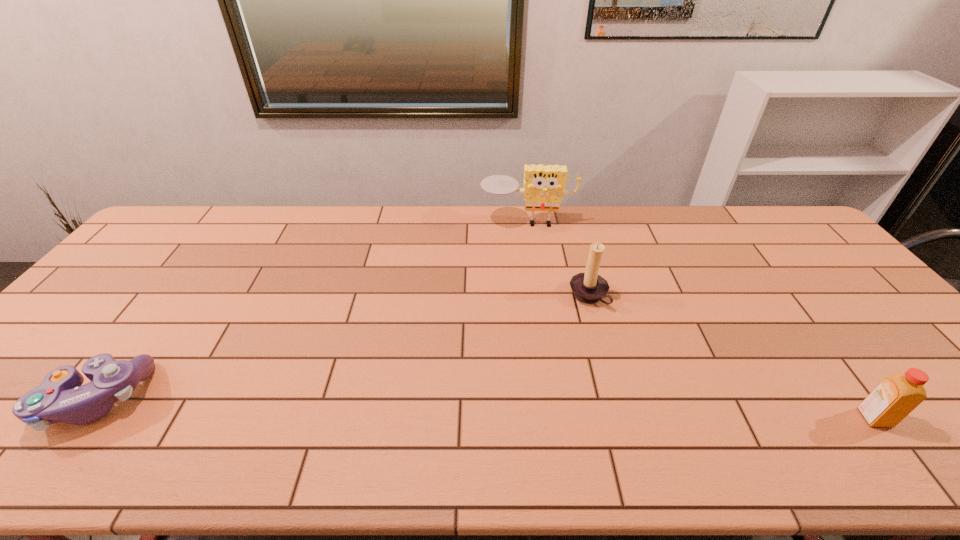
Image resolution: width=960 pixels, height=540 pixels. I want to click on the shortest object, so click(60, 397).

At what (x,y) coordinates should I click in order to perform the action: click on the leftmost object. Please return your answer as a coordinate pair (x, y). The image size is (960, 540). Looking at the image, I should click on (60, 397).

Identify the location of the second shortest object. Image resolution: width=960 pixels, height=540 pixels. pyautogui.click(x=896, y=396).

What are the coordinates of `orange juice` in the screenshot? It's located at (896, 396).

This screenshot has width=960, height=540. I want to click on candle holder, so click(589, 287).

Find the location of a particular element. Image resolution: width=960 pixels, height=540 pixels. the farthest object is located at coordinates click(x=543, y=190).

At what (x,y) coordinates should I click in order to perform the action: click on free space located 0.370m on the right of the leftmost object. Please return your answer as a coordinate pair (x, y). The image size is (960, 540). Looking at the image, I should click on (309, 399).

The width and height of the screenshot is (960, 540). Identify the location of vacant point located on the front and back of the second shortest object. (909, 418).

Find the location of `blank area located 0.090m on the wick of the third nearest object`. blank area located 0.090m on the wick of the third nearest object is located at coordinates (550, 318).

The image size is (960, 540). I want to click on vacant space located on the wick of the third nearest object, so click(x=518, y=334).